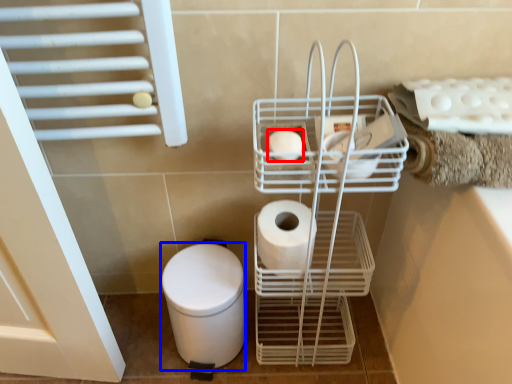
Question: Which of the following is the farthest to the observer, toilet paper (highlighted by a red box) or bidet (highlighted by a blue box)?

Choices:
 (A) toilet paper
 (B) bidet

Answer: (B)